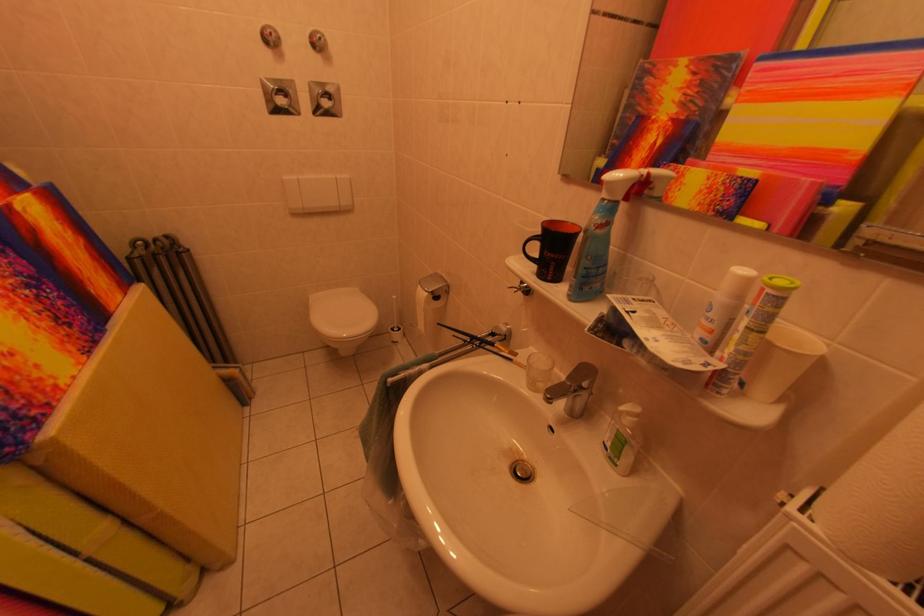
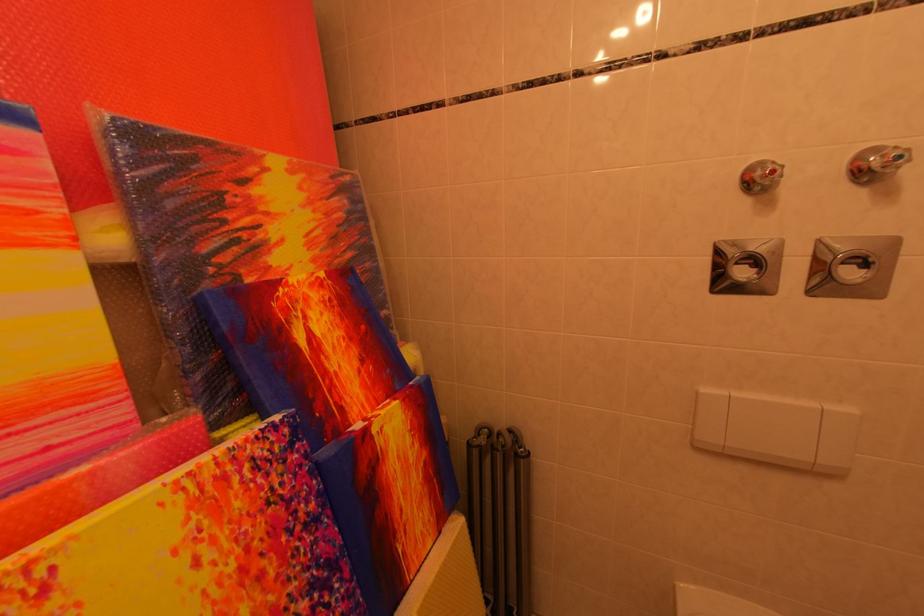
Find the pixel in the second image that matches pixel 289 106 in the first image.

(751, 277)